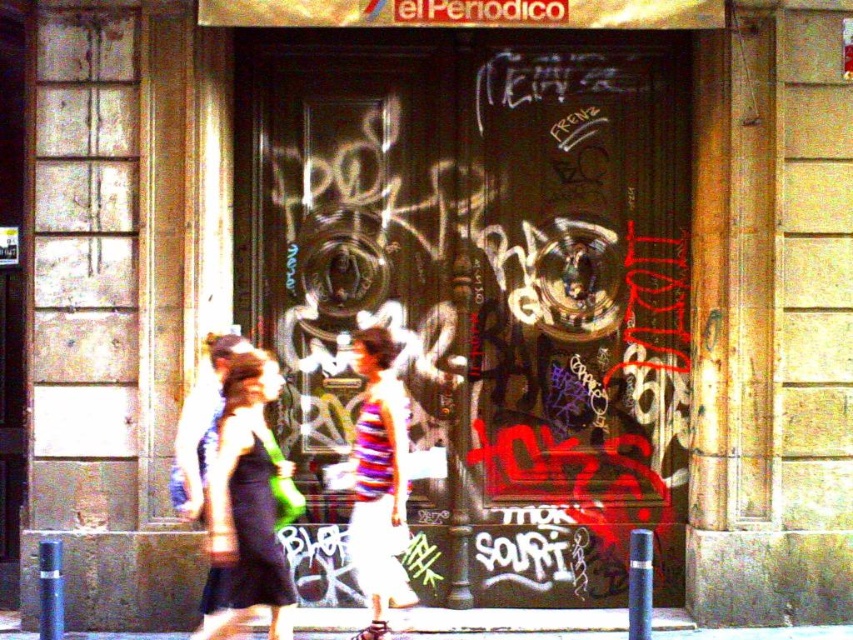
Question: Does matte black dress at center appear under striped fabric dress at center?

Choices:
 (A) no
 (B) yes

Answer: (B)

Question: In this image, where is matte black dress at center located relative to striped fabric dress at center?

Choices:
 (A) above
 (B) below

Answer: (B)

Question: Which object appears farthest from the camera in this image?

Choices:
 (A) matte black dress at center
 (B) striped fabric dress at center

Answer: (B)

Question: Which object appears closest to the camera in this image?

Choices:
 (A) matte black dress at center
 (B) striped fabric dress at center

Answer: (A)

Question: Where is matte black dress at center located in relation to striped fabric dress at center in the image?

Choices:
 (A) right
 (B) left

Answer: (B)